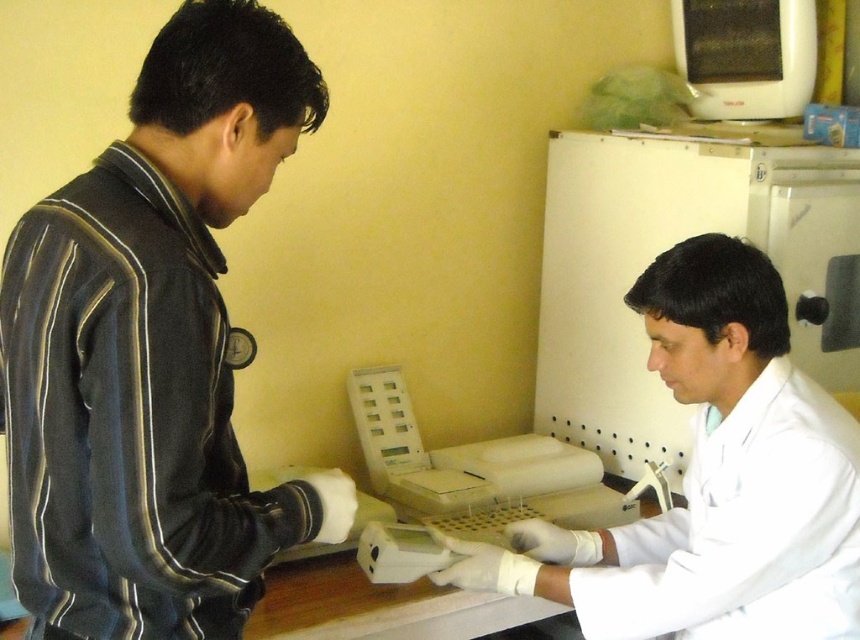
You are a visitor in the lab and need to approach both the dark blue fabric jacket at left and the white lab coat at center. Which one should you walk towards first to reach the one closer to you?

You should walk towards the dark blue fabric jacket at left first because it is closer to you than the white lab coat at center.

In the laboratory scene, there is a white lab coat at center and a black plastic microwave at upper right. From the perspective of someone standing in front of the image, which object is positioned to the left?

The white lab coat at center is to the left of the black plastic microwave at upper right.

You are observing two points in the image. The first point is at coordinate point (219, 445) and the second is at point (714, 45). Which of these points is nearer to the camera?

Point (219, 445) is closer to the camera than point (714, 45).